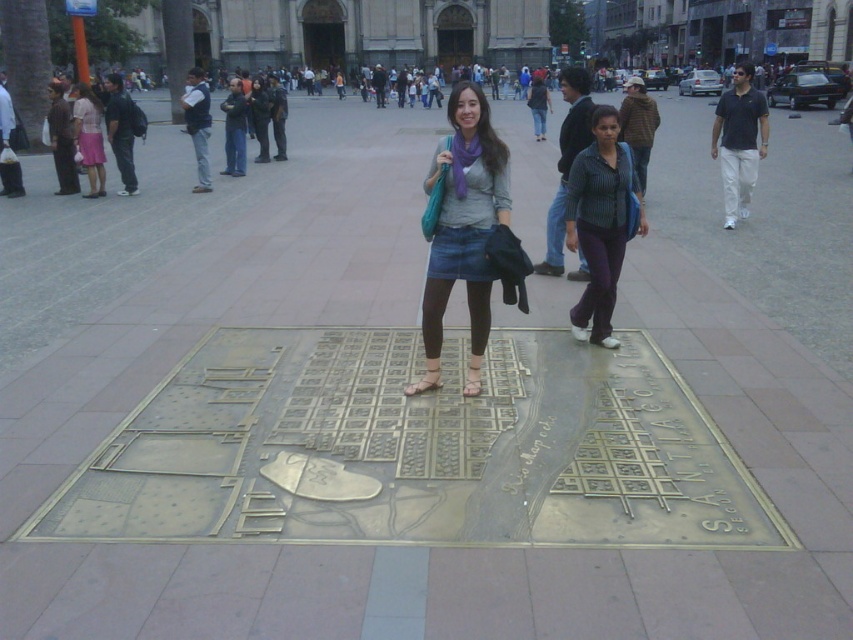
Looking at this image, does denim skirt at center appear on the left side of dark gray polo shirt at right?

Correct, you'll find denim skirt at center to the left of dark gray polo shirt at right.

In order to click on denim skirt at center in this screenshot , I will do `click(463, 228)`.

Based on the photo, measure the distance between striped fabric shirt at center and matte pink skirt at left.

They are 10.87 meters apart.

Does striped fabric shirt at center have a greater width compared to matte pink skirt at left?

Correct, the width of striped fabric shirt at center exceeds that of matte pink skirt at left.

I want to click on striped fabric shirt at center, so click(x=601, y=221).

Is dark gray polo shirt at right positioned before matte pink skirt at left?

Yes, dark gray polo shirt at right is closer to the viewer.

Can you confirm if dark gray polo shirt at right is thinner than matte pink skirt at left?

In fact, dark gray polo shirt at right might be wider than matte pink skirt at left.

Does point (712, 147) come in front of point (99, 163)?

No, it is not.

Identify the location of dark gray polo shirt at right. This screenshot has height=640, width=853. (740, 141).